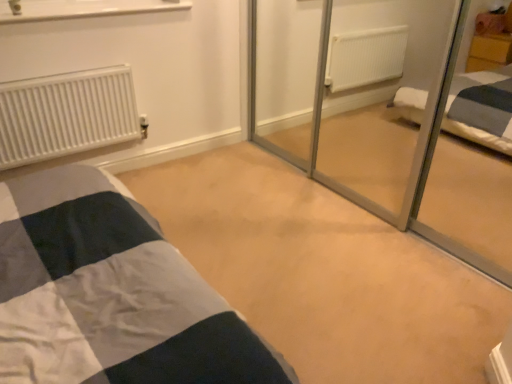
Identify the location of vacant area on top of white matte radiator at left (from a real-world perspective). The height and width of the screenshot is (384, 512). (47, 73).